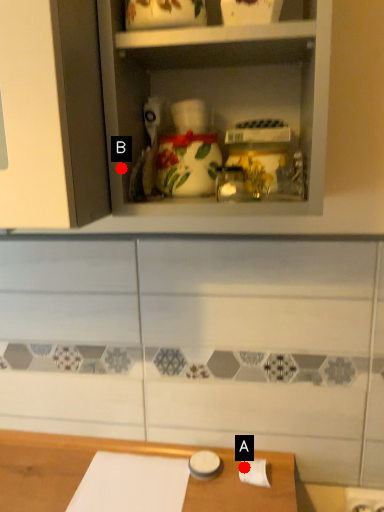
Question: Two points are circled on the image, labeled by A and B beside each circle. Which point appears closest to the camera in this image?

Choices:
 (A) A is closer
 (B) B is closer

Answer: (B)